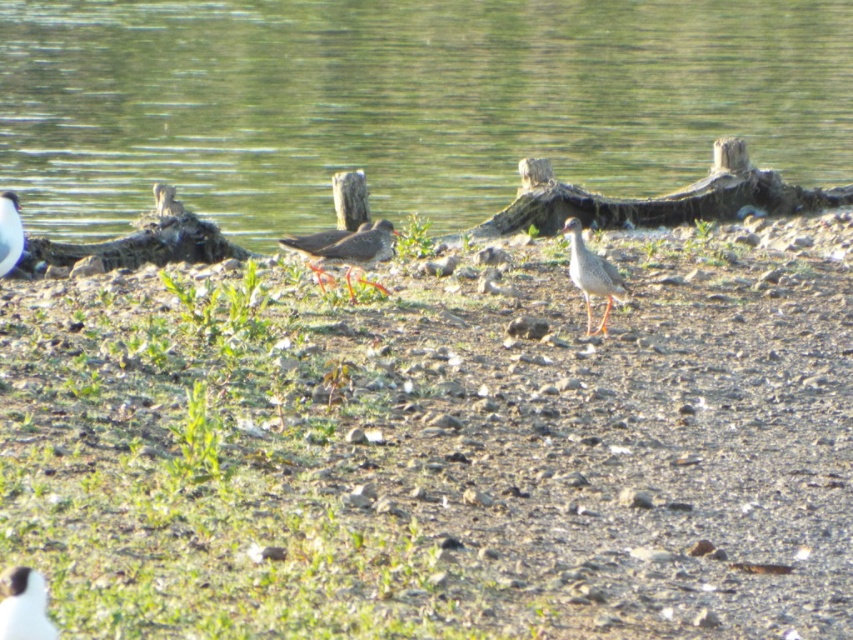
Question: Does speckled feathered bird at center have a smaller size compared to white glossy bird at lower left?

Choices:
 (A) no
 (B) yes

Answer: (A)

Question: Which object appears closest to the camera in this image?

Choices:
 (A) white matte bird at lower left
 (B) white glossy bird at lower left
 (C) speckled gray bird at center
 (D) speckled feathered bird at center

Answer: (A)

Question: Is speckled feathered bird at center to the left of white matte bird at lower left from the viewer's perspective?

Choices:
 (A) yes
 (B) no

Answer: (B)

Question: Among these points, which one is nearest to the camera?

Choices:
 (A) (604, 324)
 (B) (16, 221)

Answer: (B)

Question: Observing the image, what is the correct spatial positioning of green water at center in reference to speckled gray bird at center?

Choices:
 (A) right
 (B) left

Answer: (B)

Question: Which point is farther from the camera taking this photo?

Choices:
 (A) (387, 232)
 (B) (12, 252)
 (C) (15, 620)
 (D) (740, 134)

Answer: (D)